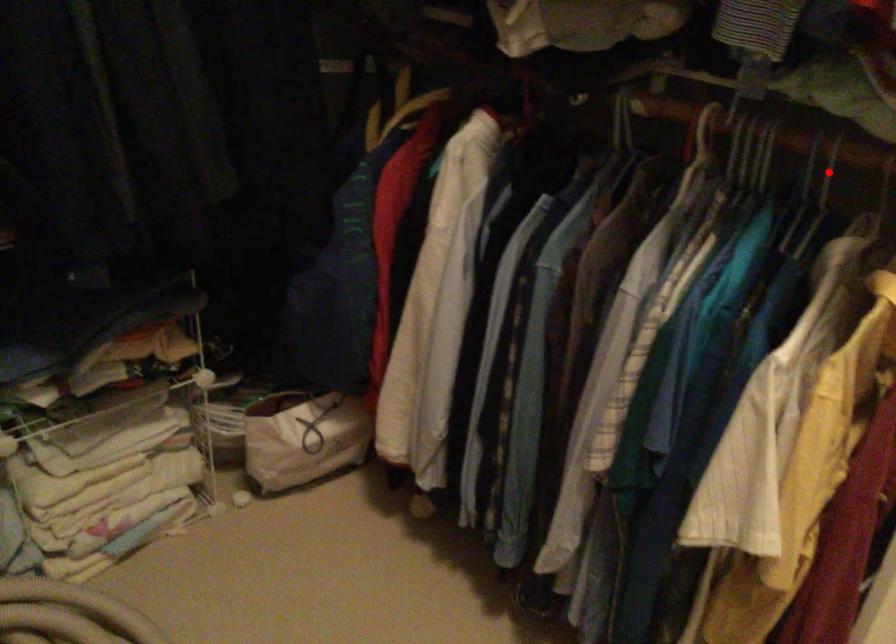
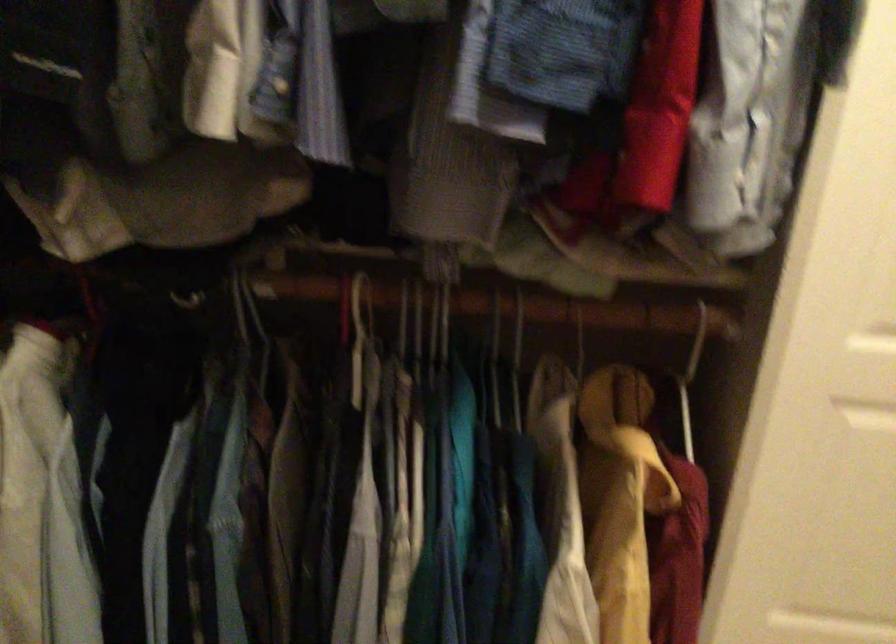
Question: I am providing you with two images of the same scene from different viewpoints. In image1, a red point is highlighted. Considering the same 3D point in image2, which of the following is correct?

Choices:
 (A) It is closer
 (B) It is farther

Answer: (A)